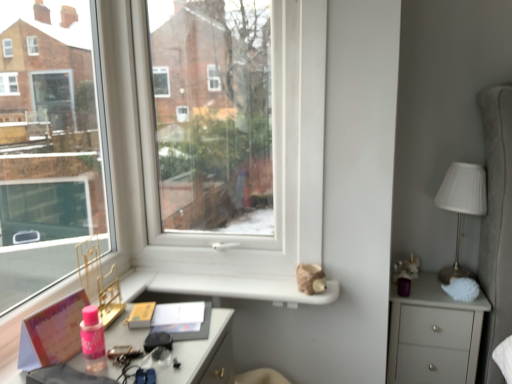
Question: Relative to pink matte book at lower left, is matte gray chest of drawers at right in front or behind?

Choices:
 (A) behind
 (B) front

Answer: (A)

Question: From a real-world perspective, relative to pink matte book at lower left, is matte gray chest of drawers at right vertically above or below?

Choices:
 (A) above
 (B) below

Answer: (B)

Question: Considering the real-world distances, which object is closest to the matte gray chest of drawers at right?

Choices:
 (A) transparent glass window at center
 (B) pink matte book at lower left
 (C) white ribbed fabric at right

Answer: (C)

Question: Estimate the real-world distances between objects in this image. Which object is farther from the matte gray chest of drawers at right?

Choices:
 (A) white ribbed fabric at right
 (B) transparent glass window at center
 (C) pink matte book at lower left

Answer: (C)